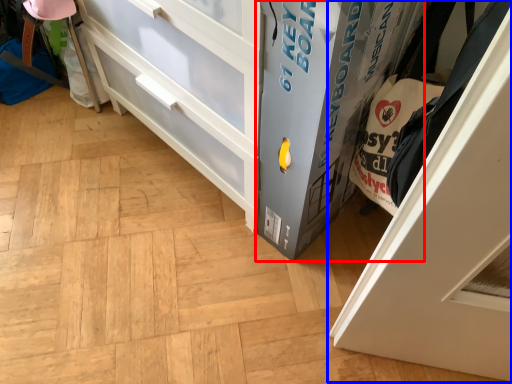
Question: Which object is closer to the camera taking this photo, cabinetry (highlighted by a red box) or door (highlighted by a blue box)?

Choices:
 (A) cabinetry
 (B) door

Answer: (B)